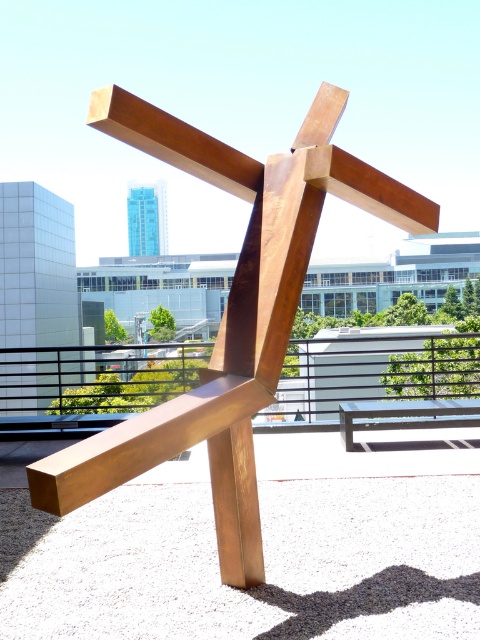
Is point (312, 241) more distant than point (56, 406)?

No, (312, 241) is in front of (56, 406).

Locate an element on the screen. bronze metallic sculpture at center is located at coordinates (230, 312).

Is point (156, 406) positioned after point (108, 355)?

That is False.

The width and height of the screenshot is (480, 640). I want to click on bronze metallic sculpture at center, so click(x=230, y=312).

Between point (232, 573) and point (411, 403), which one is positioned in front?

Point (232, 573) is more forward.

Is point (330, 168) positioned in front of point (374, 426)?

Yes, point (330, 168) is in front of point (374, 426).

The width and height of the screenshot is (480, 640). What do you see at coordinates (230, 312) in the screenshot?
I see `bronze metallic sculpture at center` at bounding box center [230, 312].

You are a GUI agent. You are given a task and a screenshot of the screen. Output one action in this format:
    pyautogui.click(x=<x>, y=<y>)
    Task: Click on the bronze metallic sculpture at center
    
    Given the screenshot: What is the action you would take?
    pyautogui.click(x=230, y=312)

Between satin brown railing at center and wooden park bench at center, which one appears on the left side from the viewer's perspective?

satin brown railing at center

Consider the image. Can you confirm if satin brown railing at center is thinner than wooden park bench at center?

No, satin brown railing at center is not thinner than wooden park bench at center.

Who is more forward, (x=36, y=364) or (x=386, y=410)?

Point (x=386, y=410) is more forward.

The height and width of the screenshot is (640, 480). I want to click on satin brown railing at center, so click(x=90, y=387).